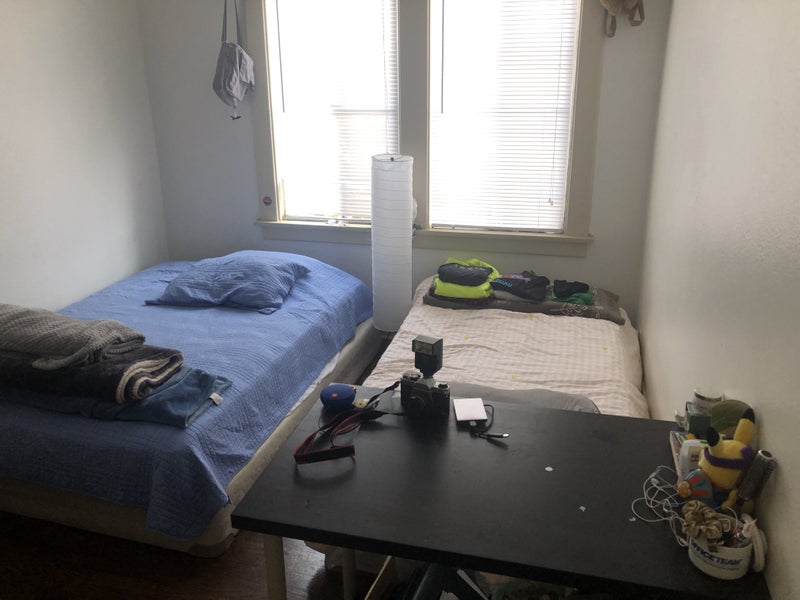
At what (x,y) coordinates should I click in order to perform the action: click on blinds. Please return your answer as a coordinate pair (x, y). The width and height of the screenshot is (800, 600). Looking at the image, I should click on (478, 171), (270, 112).